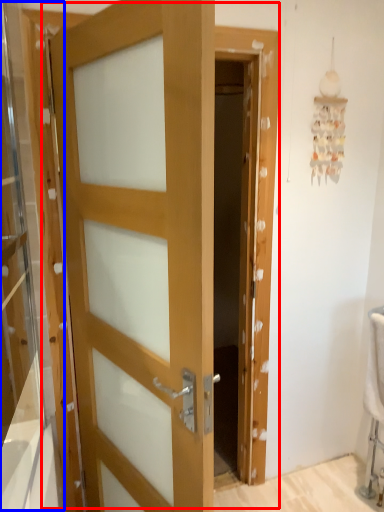
Question: Which of the following is the closest to the observer, door (highlighted by a red box) or glass door (highlighted by a blue box)?

Choices:
 (A) door
 (B) glass door

Answer: (B)